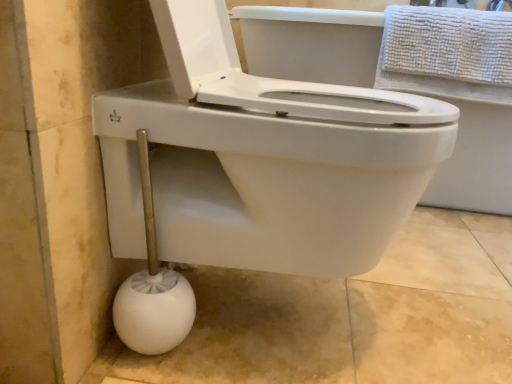
What is the approximate height of white textured towel at upper right?

10.93 inches.

I want to click on white textured towel at upper right, so click(x=447, y=53).

Describe the element at coordinates (447, 53) in the screenshot. The width and height of the screenshot is (512, 384). I see `white textured towel at upper right` at that location.

What do you see at coordinates (153, 288) in the screenshot? I see `white plastic toilet brush at lower left` at bounding box center [153, 288].

At what (x,y) coordinates should I click in order to perform the action: click on white plastic toilet brush at lower left. Please return your answer as a coordinate pair (x, y). The height and width of the screenshot is (384, 512). Looking at the image, I should click on (153, 288).

The image size is (512, 384). I want to click on white textured towel at upper right, so click(x=447, y=53).

Is white textured towel at upper right to the left of white plastic toilet brush at lower left from the viewer's perspective?

In fact, white textured towel at upper right is to the right of white plastic toilet brush at lower left.

Considering the positions of objects white textured towel at upper right and white plastic toilet brush at lower left in the image provided, who is behind, white textured towel at upper right or white plastic toilet brush at lower left?

Positioned behind is white textured towel at upper right.

Is point (409, 19) farther from camera compared to point (189, 294)?

Yes, it is behind point (189, 294).

From the image's perspective, is white textured towel at upper right under white plastic toilet brush at lower left?

No, from the image's perspective, white textured towel at upper right is not beneath white plastic toilet brush at lower left.

Looking at this image, from a real-world perspective, is white textured towel at upper right positioned under white plastic toilet brush at lower left based on gravity?

No, from a real-world perspective, white textured towel at upper right is not under white plastic toilet brush at lower left.

Considering the relative sizes of white textured towel at upper right and white plastic toilet brush at lower left in the image provided, is white textured towel at upper right wider than white plastic toilet brush at lower left?

Correct, the width of white textured towel at upper right exceeds that of white plastic toilet brush at lower left.

Between white textured towel at upper right and white plastic toilet brush at lower left, which one has more height?

Standing taller between the two is white plastic toilet brush at lower left.

Considering the relative sizes of white textured towel at upper right and white plastic toilet brush at lower left in the image provided, is white textured towel at upper right bigger than white plastic toilet brush at lower left?

Correct, white textured towel at upper right is larger in size than white plastic toilet brush at lower left.

Is white textured towel at upper right surrounding white plastic toilet brush at lower left?

Actually, white plastic toilet brush at lower left is outside white textured towel at upper right.

Are white textured towel at upper right and white plastic toilet brush at lower left beside each other?

There is a gap between white textured towel at upper right and white plastic toilet brush at lower left.

Is white plastic toilet brush at lower left at the back of white textured towel at upper right?

That's not correct — white textured towel at upper right is not looking away from white plastic toilet brush at lower left.

I want to click on shower below the white textured towel at upper right (from the image's perspective), so click(153, 288).

Is white plastic toilet brush at lower left to the left of white textured towel at upper right from the viewer's perspective?

Indeed, white plastic toilet brush at lower left is positioned on the left side of white textured towel at upper right.

Which object is more forward, white plastic toilet brush at lower left or white textured towel at upper right?

white plastic toilet brush at lower left is in front.

Is point (137, 284) positioned after point (433, 27)?

That is False.

From the image's perspective, is white plastic toilet brush at lower left beneath white textured towel at upper right?

Indeed, from the image's perspective, white plastic toilet brush at lower left is shown beneath white textured towel at upper right.

From a real-world perspective, which object stands above the other?

white textured towel at upper right.

Considering the sizes of objects white plastic toilet brush at lower left and white textured towel at upper right in the image provided, who is thinner, white plastic toilet brush at lower left or white textured towel at upper right?

white plastic toilet brush at lower left.

Can you confirm if white plastic toilet brush at lower left is taller than white textured towel at upper right?

Correct, white plastic toilet brush at lower left is much taller as white textured towel at upper right.

Between white plastic toilet brush at lower left and white textured towel at upper right, which one has larger size?

white textured towel at upper right is bigger.

Is white textured towel at upper right completely or partially inside white plastic toilet brush at lower left?

Definitely not — white textured towel at upper right is not inside white plastic toilet brush at lower left.

Can you see white plastic toilet brush at lower left touching white textured towel at upper right?

white plastic toilet brush at lower left and white textured towel at upper right are not in contact.

Is white plastic toilet brush at lower left oriented towards white textured towel at upper right?

No, white plastic toilet brush at lower left is not facing towards white textured towel at upper right.

Can you tell me how much white plastic toilet brush at lower left and white textured towel at upper right differ in facing direction?

The angular difference between white plastic toilet brush at lower left and white textured towel at upper right is 92.3 degrees.

The image size is (512, 384). What are the coordinates of `shower that appears in front of the white textured towel at upper right` in the screenshot? It's located at (153, 288).

Locate an element on the screen. This screenshot has height=384, width=512. towel that is on the right side of white plastic toilet brush at lower left is located at coordinates (447, 53).

The height and width of the screenshot is (384, 512). In order to click on shower to the left of white textured towel at upper right in this screenshot , I will do tap(153, 288).